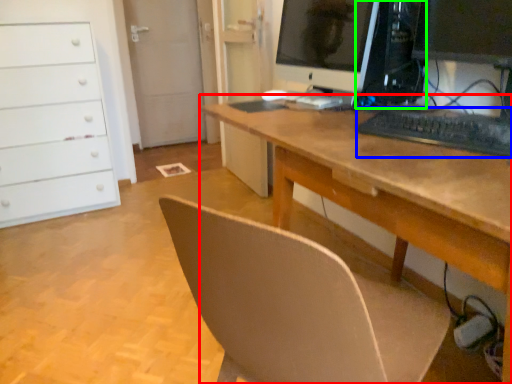
Question: Which object is the closest to the desk (highlighted by a red box)? Choose among these: keyboard (highlighted by a blue box) or desktop computer (highlighted by a green box).

Choices:
 (A) keyboard
 (B) desktop computer

Answer: (A)